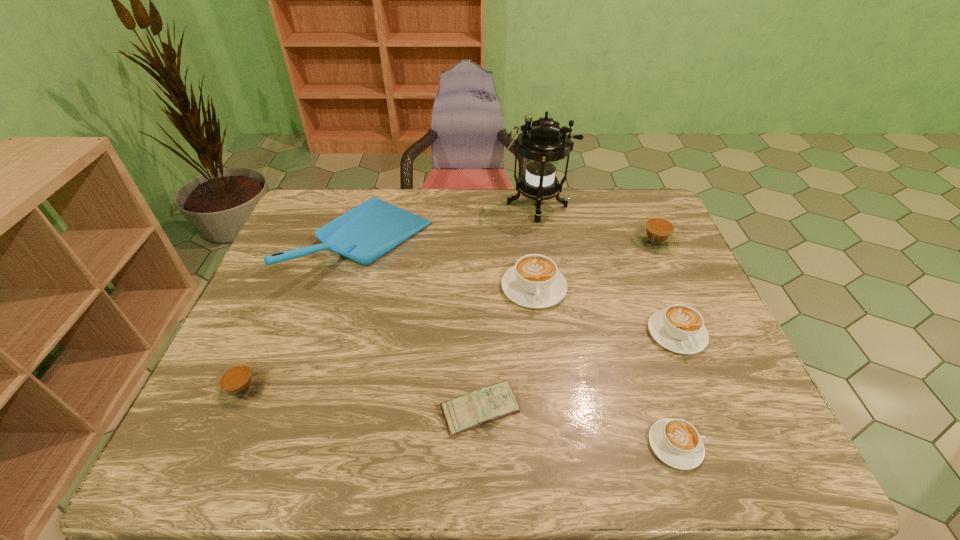
At what (x,y) coordinates should I click in order to perform the action: click on unoccupied area between the second tallest object and the farther brown cappuccino. Please return your answer as a coordinate pair (x, y). This screenshot has width=960, height=540. Looking at the image, I should click on (511, 242).

The width and height of the screenshot is (960, 540). What are the coordinates of `free space that is in between the bigger brown cappuccino and the second nearest cappuccino` in the screenshot? It's located at (448, 315).

Locate an element on the screen. The width and height of the screenshot is (960, 540). free space between the leftmost white cappuccino and the diary is located at coordinates (507, 349).

Identify which object is the closest to the lantern. Please provide its 2D coordinates. Your answer should be formatted as a tuple, i.e. [(x, y)], where the tuple contains the x and y coordinates of a point satisfying the conditions above.

[(657, 235)]

Locate an element on the screen. Image resolution: width=960 pixels, height=540 pixels. the second closest object to the seventh shortest object is located at coordinates (238, 383).

Identify which cappuccino is located as the third nearest to the nearest white cappuccino. Please provide its 2D coordinates. Your answer should be formatted as a tuple, i.e. [(x, y)], where the tuple contains the x and y coordinates of a point satisfying the conditions above.

[(657, 235)]

Locate an element on the screen. This screenshot has height=540, width=960. the fourth closest cappuccino to the nearest white cappuccino is located at coordinates (238, 383).

The height and width of the screenshot is (540, 960). Identify the location of white cappuccino that is the third closest one to the right brown cappuccino. (676, 442).

The height and width of the screenshot is (540, 960). What are the coordinates of `white cappuccino object that ranks as the second closest to the nearer brown cappuccino` in the screenshot? It's located at (676, 442).

You are a GUI agent. You are given a task and a screenshot of the screen. Output one action in this format:
    pyautogui.click(x=<x>, y=<y>)
    Task: Click on the free space that satisfies the following two spatial constraints: 1. on the side of the second smallest white cappuccino with the handle; 2. on the side of the shortest cappuccino with the handle
    The width and height of the screenshot is (960, 540).
    Given the screenshot: What is the action you would take?
    pyautogui.click(x=722, y=446)